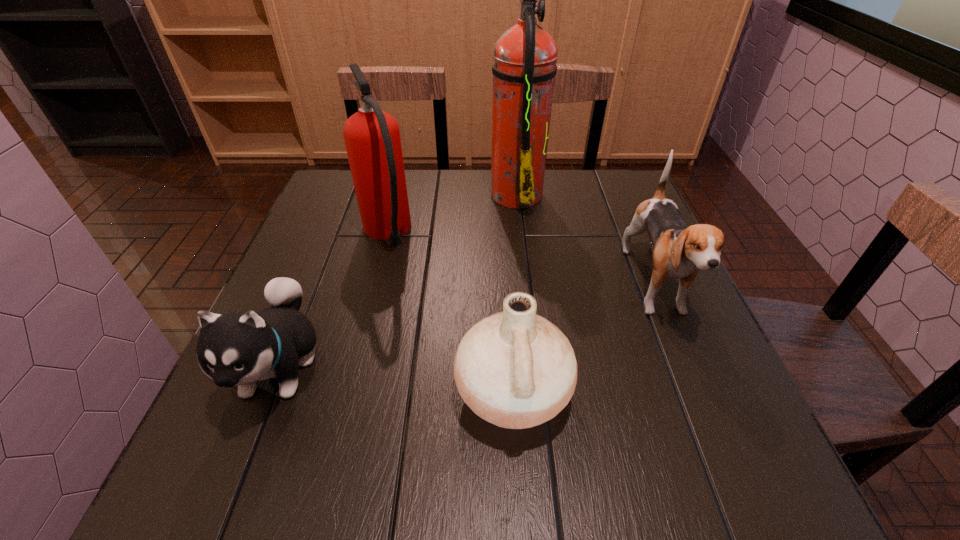
I want to click on the tallest object, so click(x=524, y=66).

Where is `the right fire extinguisher`? the right fire extinguisher is located at coordinates (524, 66).

You are a GUI agent. You are given a task and a screenshot of the screen. Output one action in this format:
    pyautogui.click(x=<x>, y=<y>)
    Task: Click on the fourth shortest object
    The width and height of the screenshot is (960, 540).
    Given the screenshot: What is the action you would take?
    pyautogui.click(x=372, y=138)

Where is `the shorter fire extinguisher`? The height and width of the screenshot is (540, 960). the shorter fire extinguisher is located at coordinates (372, 138).

This screenshot has width=960, height=540. Find the location of `the third shortest object`. the third shortest object is located at coordinates (679, 252).

Find the location of `the rightmost object`. the rightmost object is located at coordinates (679, 252).

Locate an element on the screen. pottery is located at coordinates (515, 369).

Where is `the shorter puppy`? Image resolution: width=960 pixels, height=540 pixels. the shorter puppy is located at coordinates tap(239, 348).

Locate an element on the screen. the leftmost object is located at coordinates (239, 348).

The image size is (960, 540). Identify the location of vacant area situated at the nozzle of the tallest object. (416, 193).